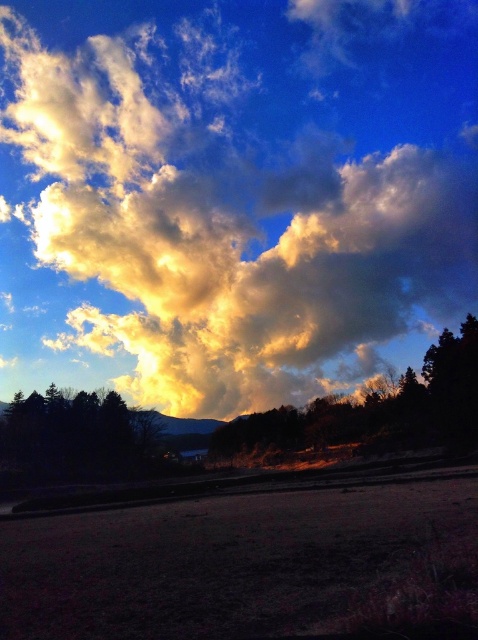
You are standing in the open area of the scene and want to take a photo of both point (315,145) and point (140,460). Which point should you focus on first to ensure both are in sharp focus?

You should focus on point (315,145) first because it is closer to the camera than point (140,460). This ensures the closer point is in focus, and the farther point will also be within the depth of field.

You are an astronomer observing the sky scene. You notice two points in the image, one at point coordinates point (83, 216) and another at point coordinates point (442, 344). Which point is closer to the horizon?

Point (442, 344) is closer to the horizon because it has a higher y coordinate value, which places it lower in the image, closer to the horizon line.